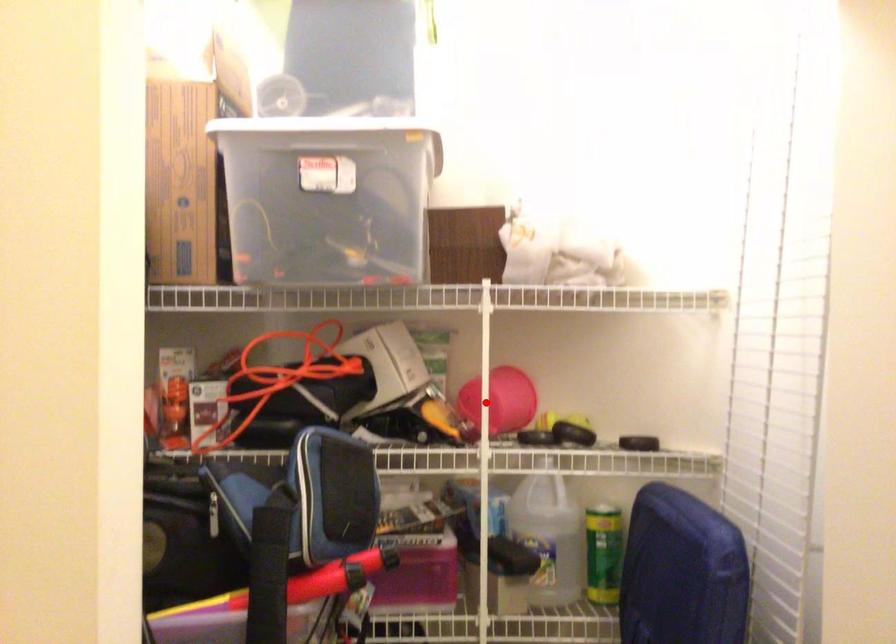
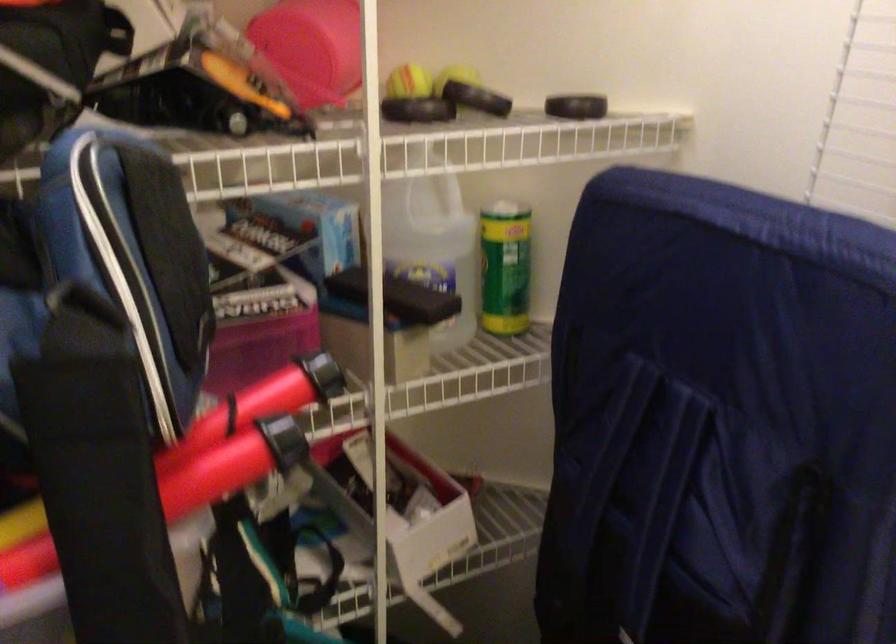
Locate, in the second image, the point that corresponds to the highlighted location in the first image.

(312, 48)